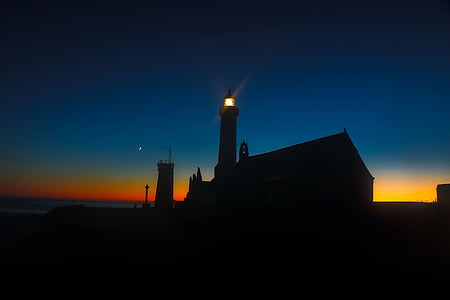
Where is `light`? The width and height of the screenshot is (450, 300). light is located at coordinates (119, 192).